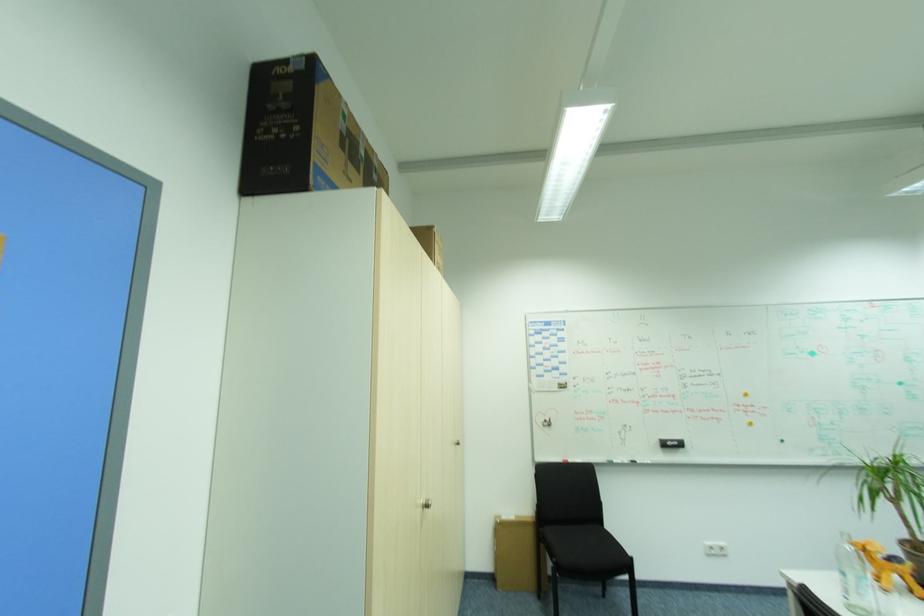
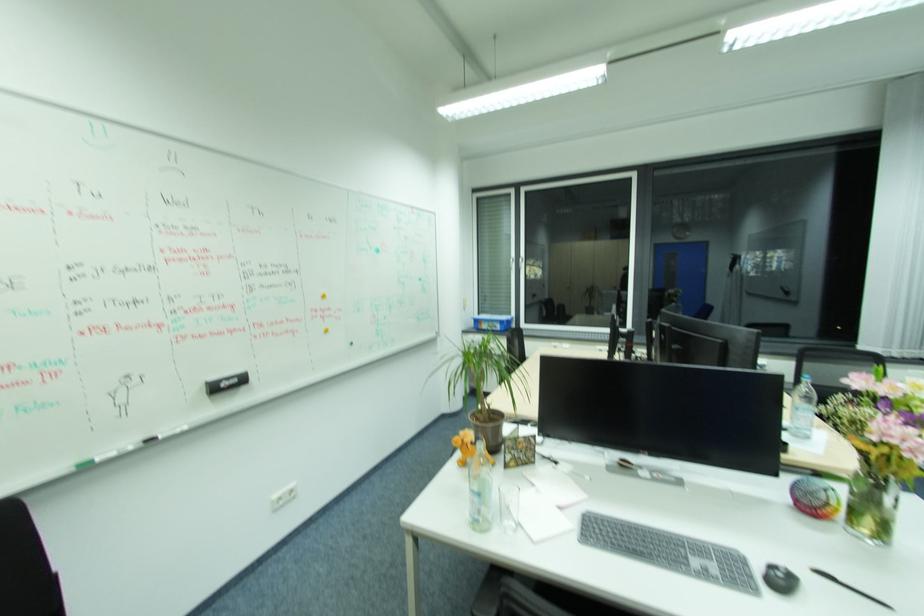
Locate, in the second image, the point that corresponds to point 751,395 in the first image.

(329, 296)